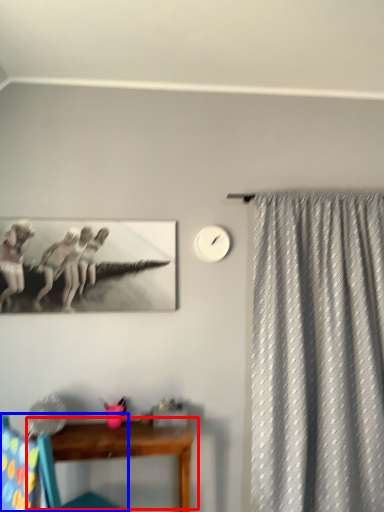
Question: Which object is further to the camera taking this photo, table (highlighted by a red box) or chair (highlighted by a blue box)?

Choices:
 (A) table
 (B) chair

Answer: (A)